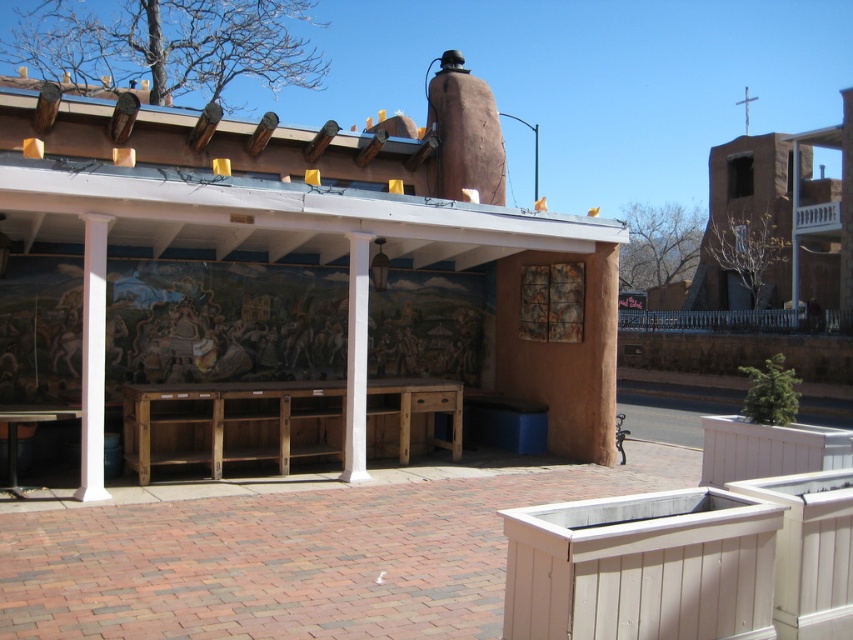
Question: Does wooden bench at center have a lesser width compared to wooden picnic table at lower left?

Choices:
 (A) no
 (B) yes

Answer: (B)

Question: Is wooden bench at center wider than wooden picnic table at lower left?

Choices:
 (A) yes
 (B) no

Answer: (B)

Question: Is wooden bench at center to the right of wooden picnic table at lower left from the viewer's perspective?

Choices:
 (A) yes
 (B) no

Answer: (A)